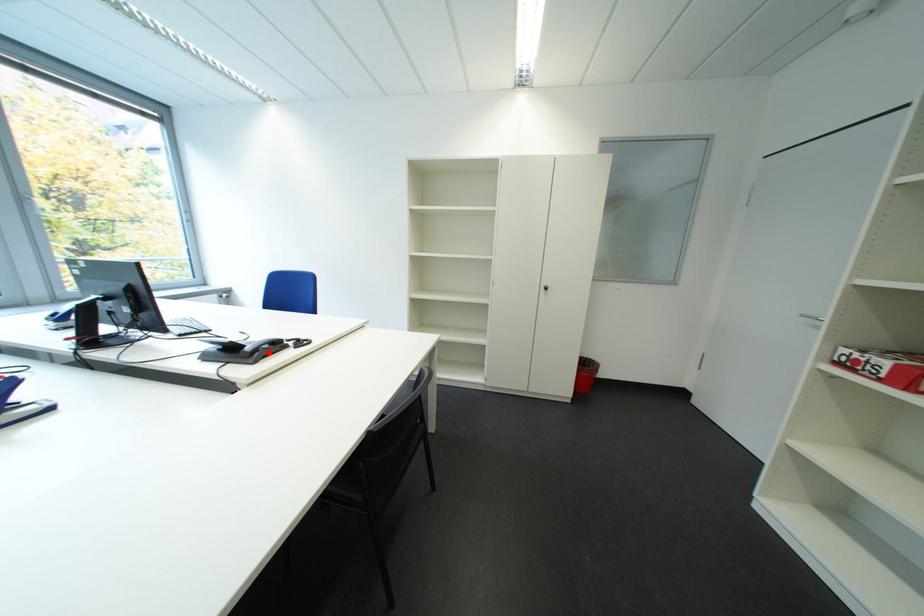
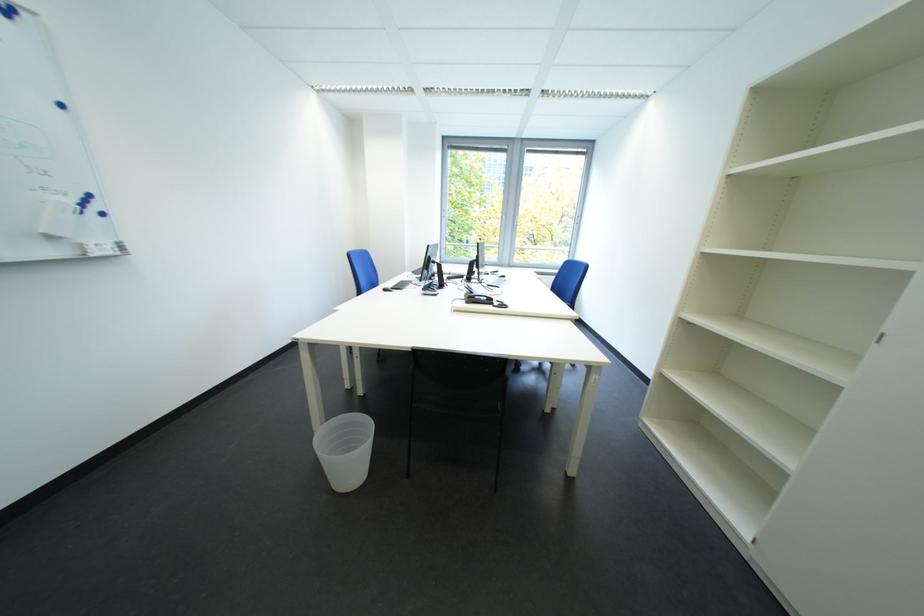
Where in the second image is the point corresponding to the highlighted location from the first image?

(485, 300)